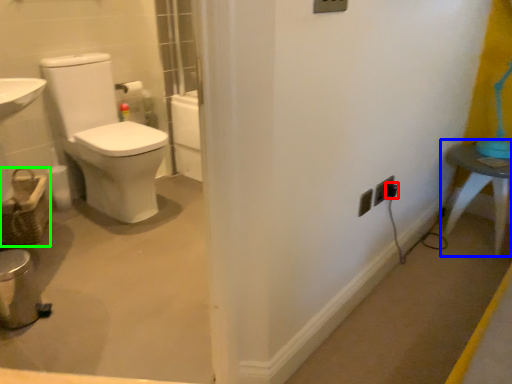
Question: Estimate the real-world distances between objects in this image. Which object is farther from electric outlet (highlighted by a red box), table (highlighted by a blue box) or basket (highlighted by a green box)?

Choices:
 (A) table
 (B) basket

Answer: (B)